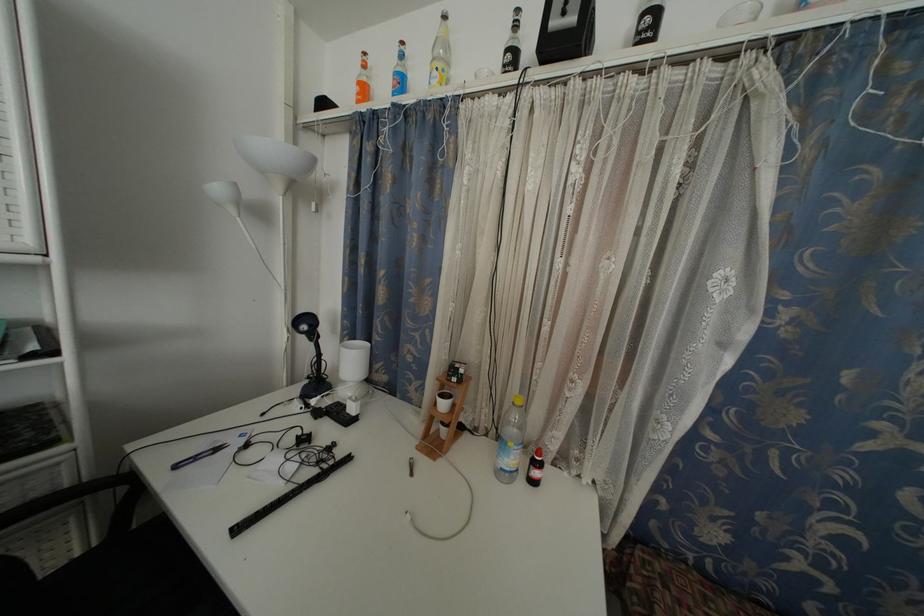
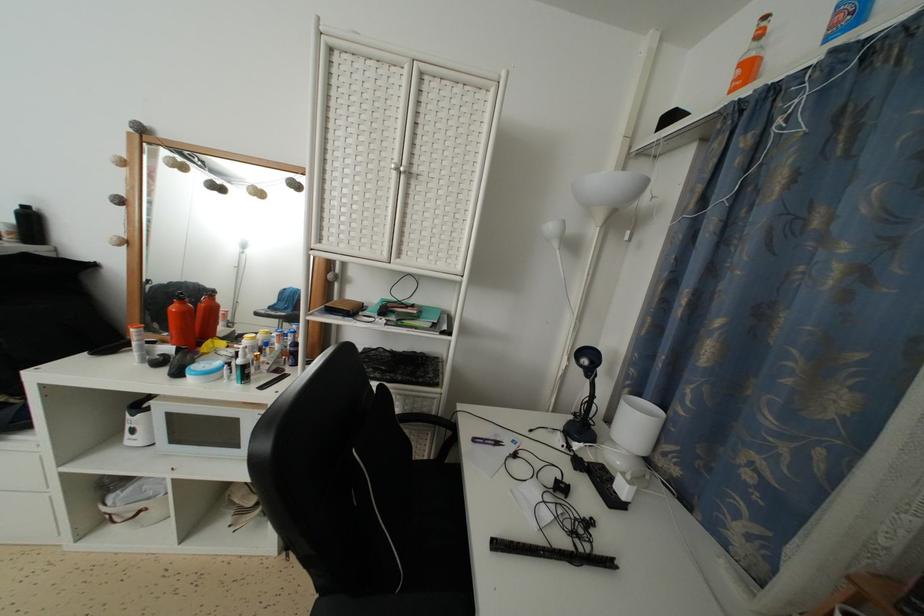
Question: The first image is from the beginning of the video and the second image is from the end. How did the camera likely rotate when shooting the video?

Choices:
 (A) Left
 (B) Right
 (C) Up
 (D) Down

Answer: (A)